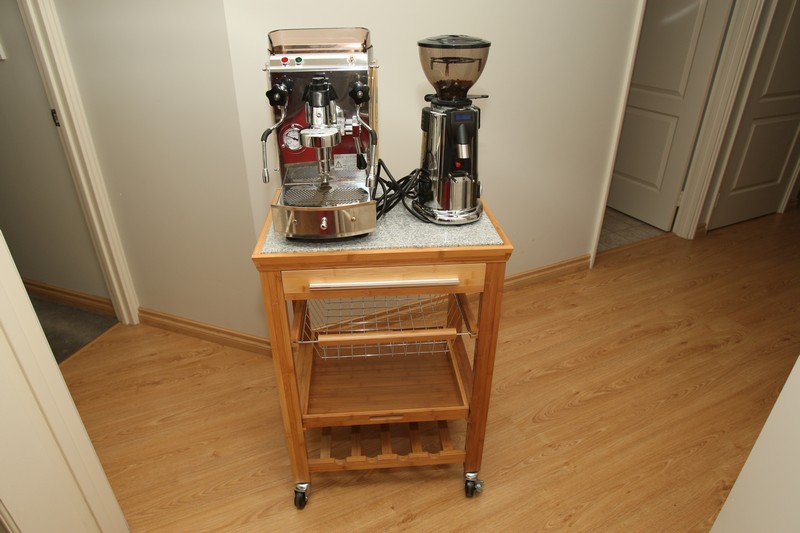
The width and height of the screenshot is (800, 533). I want to click on doors, so click(654, 133), click(742, 136).